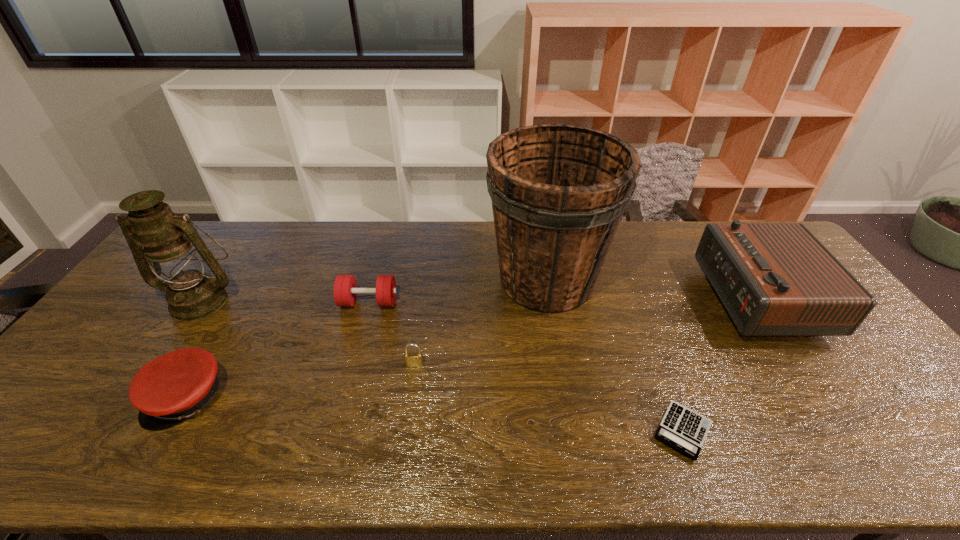
Locate an element on the screen. Image resolution: width=960 pixels, height=540 pixels. bucket is located at coordinates 558,191.

The width and height of the screenshot is (960, 540). Find the location of `the sixth shortest object`. the sixth shortest object is located at coordinates (172, 245).

Locate an element on the screen. This screenshot has width=960, height=540. radio receiver is located at coordinates (774, 279).

The height and width of the screenshot is (540, 960). Find the location of `the rightmost object`. the rightmost object is located at coordinates (774, 279).

I want to click on the third object from left to right, so click(x=345, y=287).

The image size is (960, 540). What are the coordinates of `cap` in the screenshot? It's located at (177, 385).

At what (x,y) coordinates should I click in order to perform the action: click on padlock. Please return your answer as a coordinate pair (x, y). Image resolution: width=960 pixels, height=540 pixels. Looking at the image, I should click on 412,359.

This screenshot has width=960, height=540. I want to click on the third nearest object, so click(412, 359).

The width and height of the screenshot is (960, 540). I want to click on calculator, so click(x=681, y=428).

The image size is (960, 540). Find the location of `vacant space situated 0.300m on the right of the bucket`. vacant space situated 0.300m on the right of the bucket is located at coordinates (703, 281).